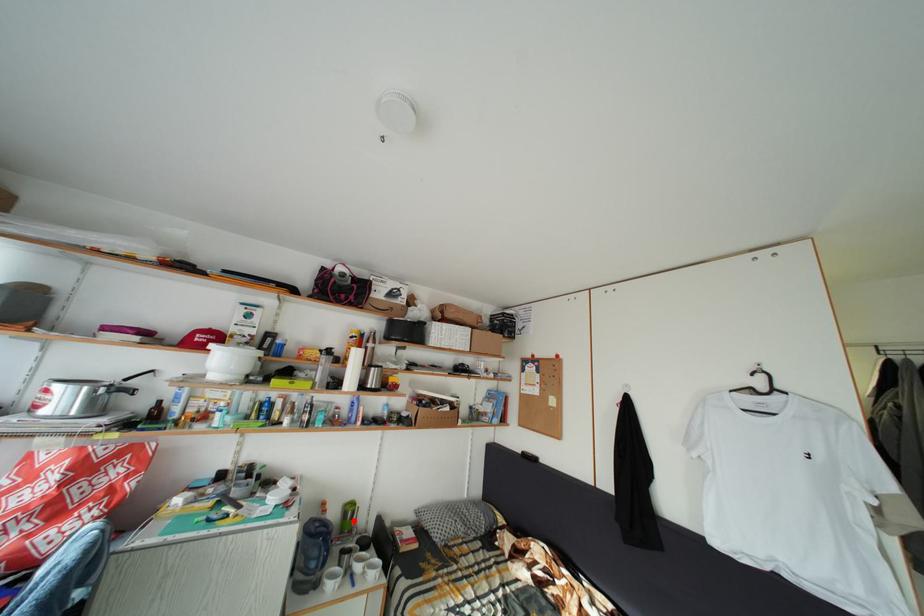
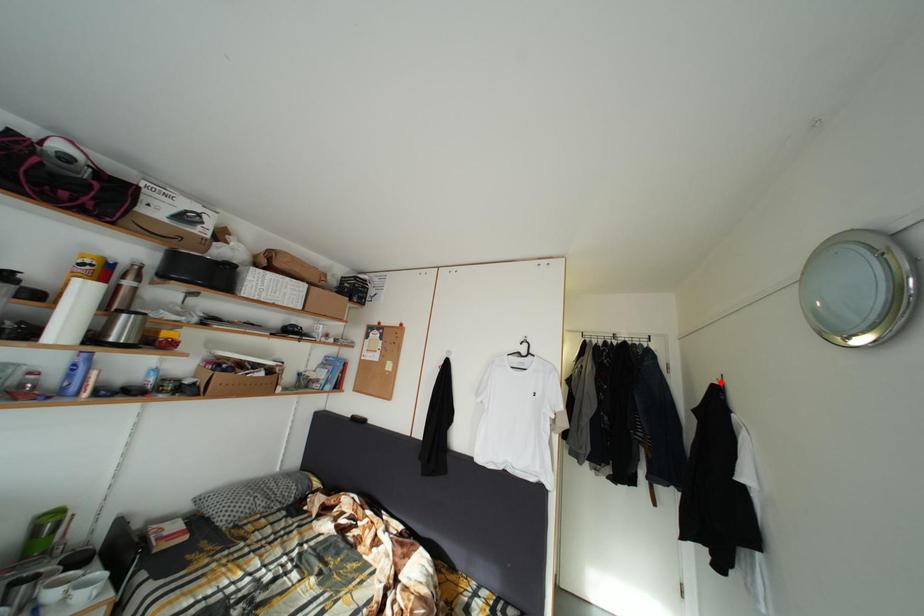
I am providing you with two images of the same scene from different viewpoints. A red point is marked on the first image and another point is marked on the second image. Is the red point in image1 aligned with the point shown in image2?

No